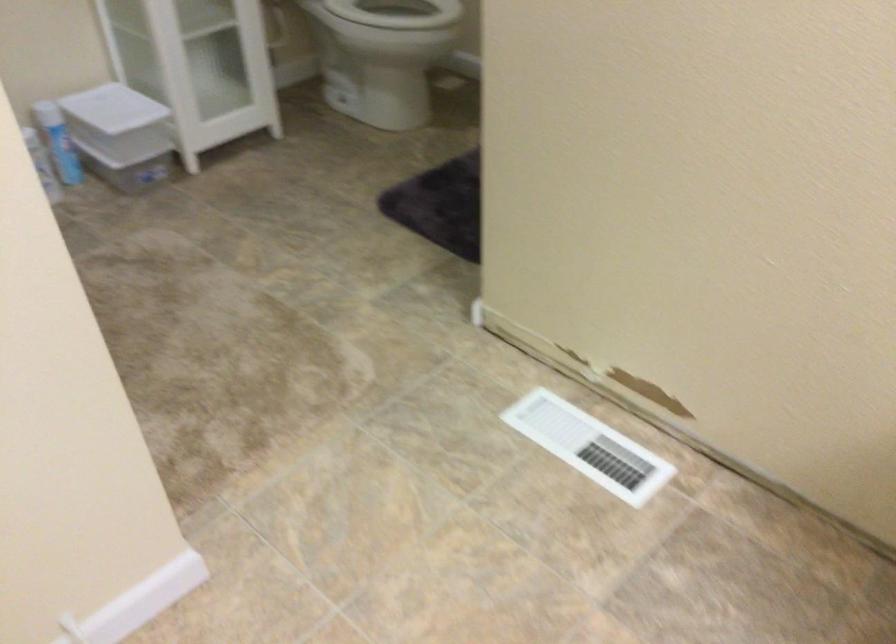
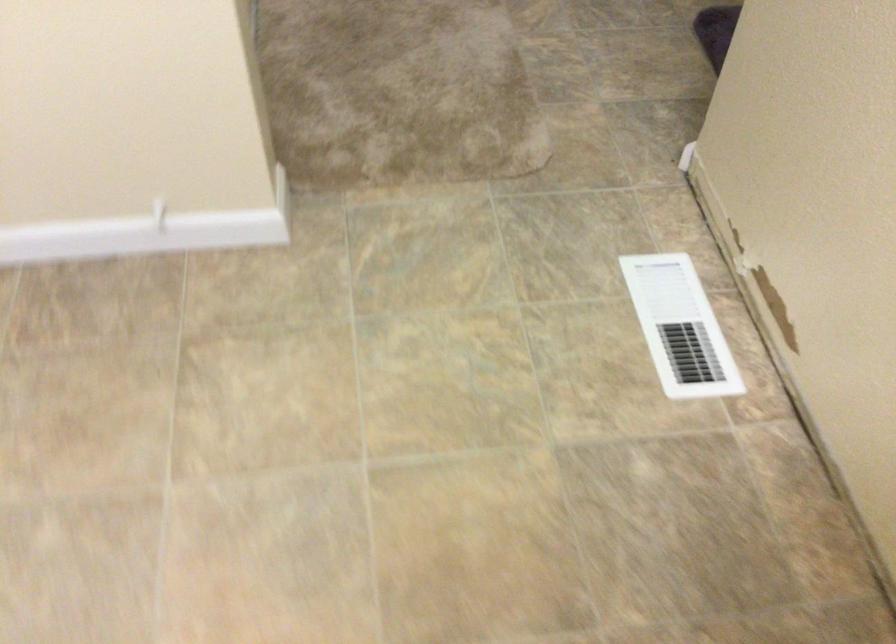
Based on the photo, based on the continuous images, in which direction is the camera rotating?

The camera rotated toward left-down.